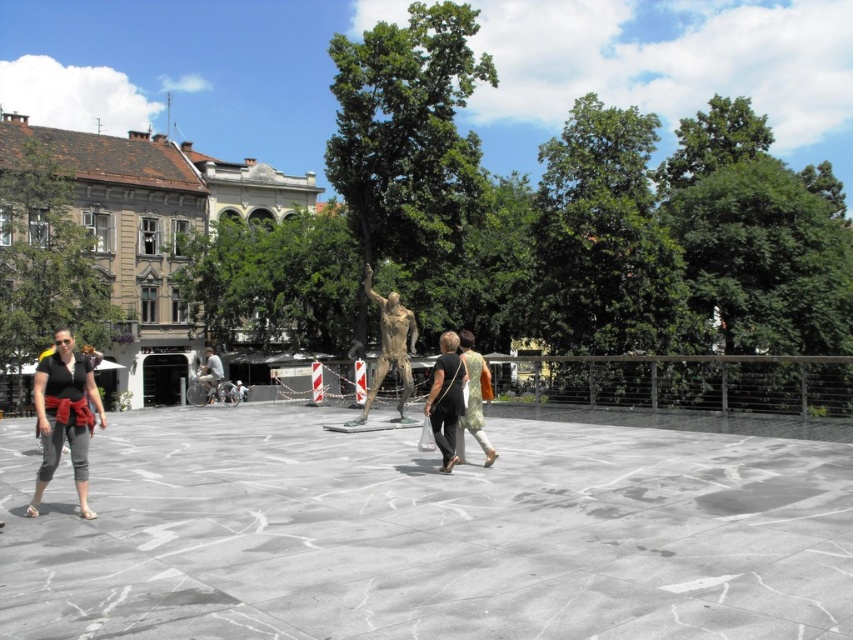
Does matte black shirt at lower left have a greater height compared to black fabric bag at center?

Yes, matte black shirt at lower left is taller than black fabric bag at center.

Between matte black shirt at lower left and black fabric bag at center, which one has less height?

black fabric bag at center

The height and width of the screenshot is (640, 853). Describe the element at coordinates (64, 417) in the screenshot. I see `matte black shirt at lower left` at that location.

Locate an element on the screen. Image resolution: width=853 pixels, height=640 pixels. matte black shirt at lower left is located at coordinates (64, 417).

Looking at this image, measure the distance between bronze statue at center and camera.

39.44 meters

Does bronze statue at center have a larger size compared to light brown leather jacket at center?

Yes, bronze statue at center is bigger than light brown leather jacket at center.

This screenshot has width=853, height=640. Describe the element at coordinates (390, 348) in the screenshot. I see `bronze statue at center` at that location.

Where is `bronze statue at center`? The height and width of the screenshot is (640, 853). bronze statue at center is located at coordinates (390, 348).

Between point (747, 508) and point (38, 372), which one is positioned in front?

Point (747, 508) is more forward.

Is gray polished stone at center to the left of matte black shirt at lower left from the viewer's perspective?

No, gray polished stone at center is not to the left of matte black shirt at lower left.

Is point (318, 458) farther from viewer compared to point (80, 461)?

Yes, point (318, 458) is farther from viewer.

At what (x,y) coordinates should I click in order to perform the action: click on gray polished stone at center. Please return your answer as a coordinate pair (x, y). Image resolution: width=853 pixels, height=640 pixels. Looking at the image, I should click on (426, 534).